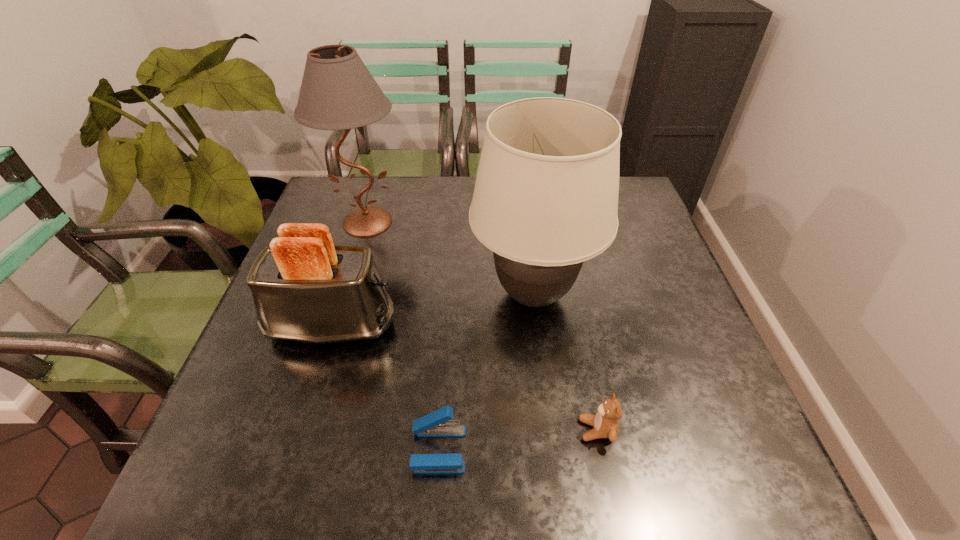
You are a GUI agent. You are given a task and a screenshot of the screen. Output one action in this format:
    pyautogui.click(x=<x>, y=<y>)
    Task: Click on the free space located on the front-facing side of the teddy bear
    This screenshot has width=960, height=540.
    Given the screenshot: What is the action you would take?
    463,430

Locate an element on the screen. vacant space located 0.290m on the front-facing side of the teddy bear is located at coordinates (425, 430).

Find the location of `free space located 0.080m on the right of the stapler`. free space located 0.080m on the right of the stapler is located at coordinates (510, 449).

You are a GUI agent. You are given a task and a screenshot of the screen. Output one action in this format:
    pyautogui.click(x=<x>, y=<y>)
    Task: Click on the object that is at the far edge
    This screenshot has width=960, height=540.
    Given the screenshot: What is the action you would take?
    pyautogui.click(x=338, y=92)

Where is `teddy bear that is at the near edge`? teddy bear that is at the near edge is located at coordinates (606, 421).

This screenshot has height=540, width=960. In order to click on stapler present at the near edge in this screenshot , I will do `click(436, 424)`.

Find the location of a particular element. table lamp located at the left edge is located at coordinates (338, 92).

Identify the location of toaster located in the left edge section of the desktop. The height and width of the screenshot is (540, 960). (306, 289).

Where is `object present at the far left corner`? object present at the far left corner is located at coordinates (338, 92).

I want to click on free space at the far edge of the desktop, so click(457, 195).